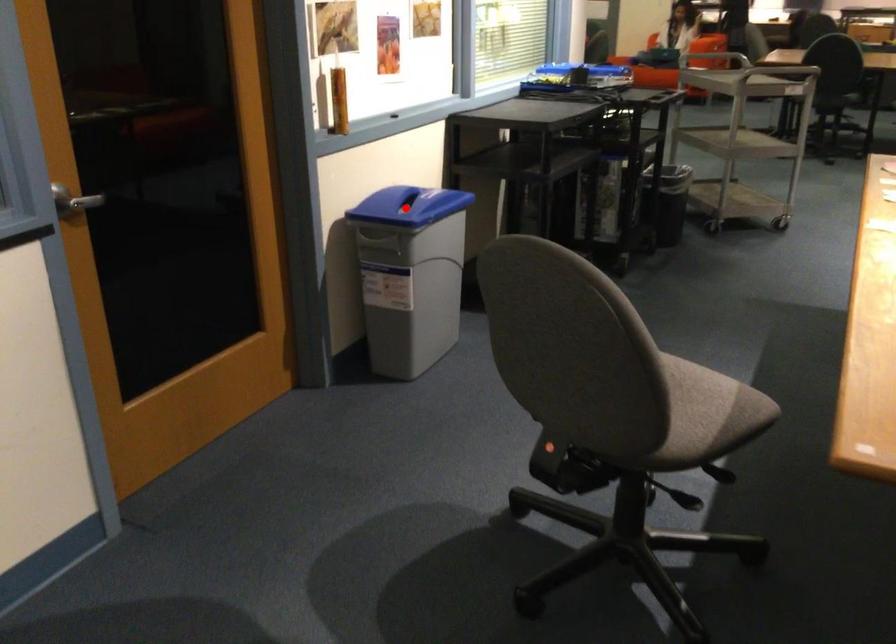
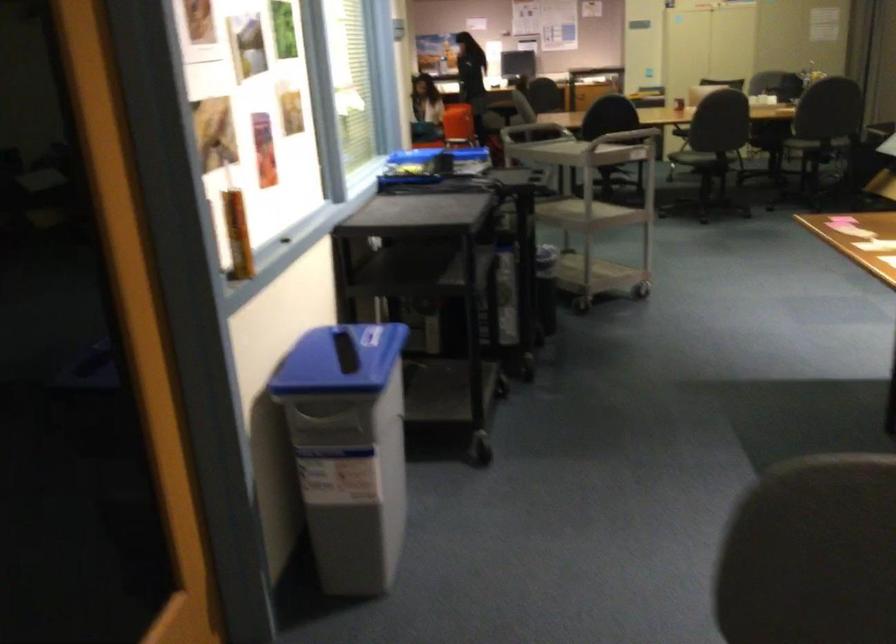
Question: I am providing you with two images of the same scene from different viewpoints. A red point is marked on the first image. Can you still see the location of the red point in image 2?

Choices:
 (A) Yes
 (B) No

Answer: (B)